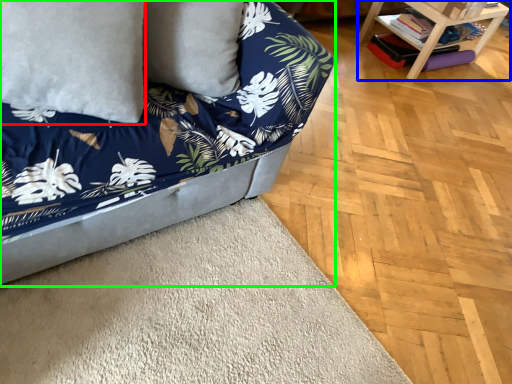
Question: Considering the real-world distances, which object is closest to pillow (highlighted by a red box)? table (highlighted by a blue box) or studio couch (highlighted by a green box).

Choices:
 (A) table
 (B) studio couch

Answer: (B)